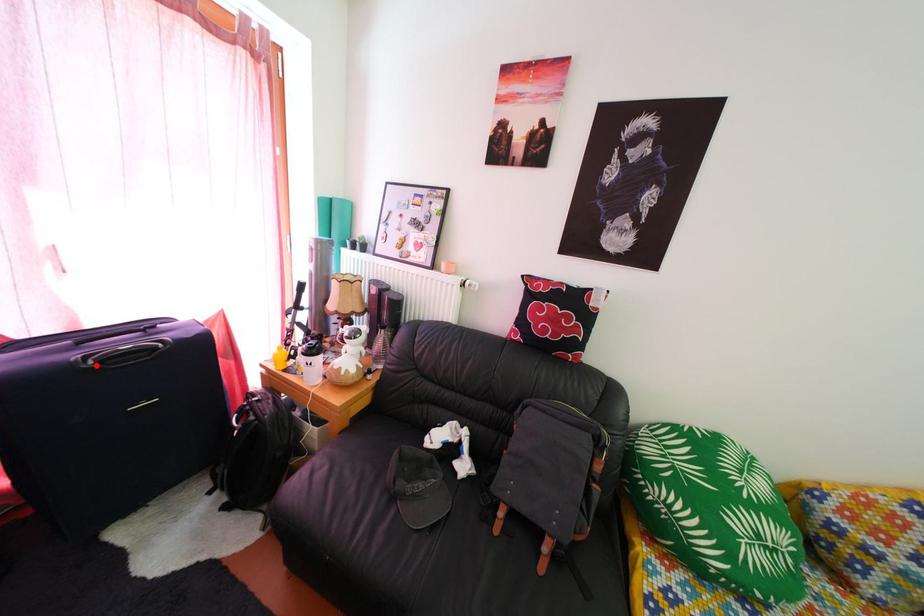
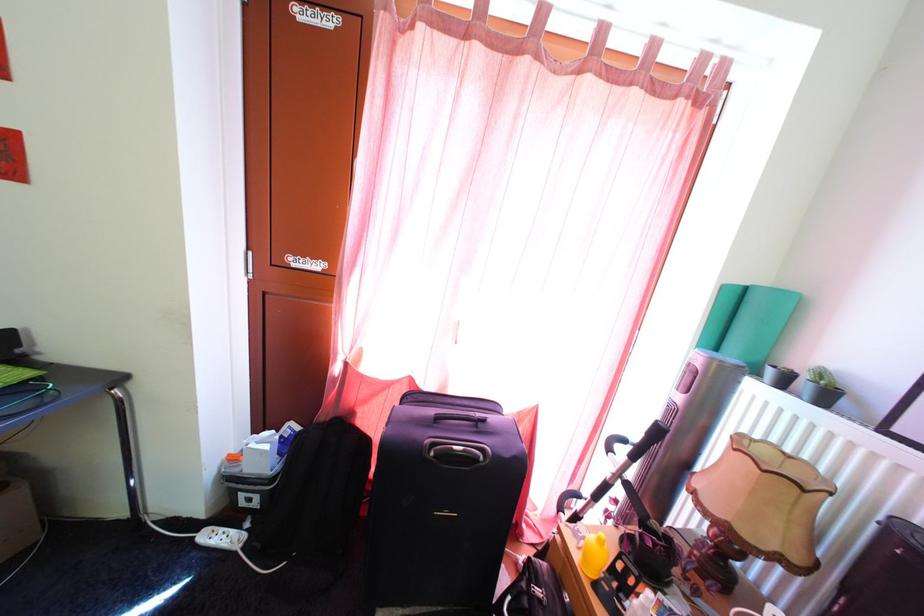
Where in the second image is the point corresponding to the highlighted location from the first image?

(441, 454)